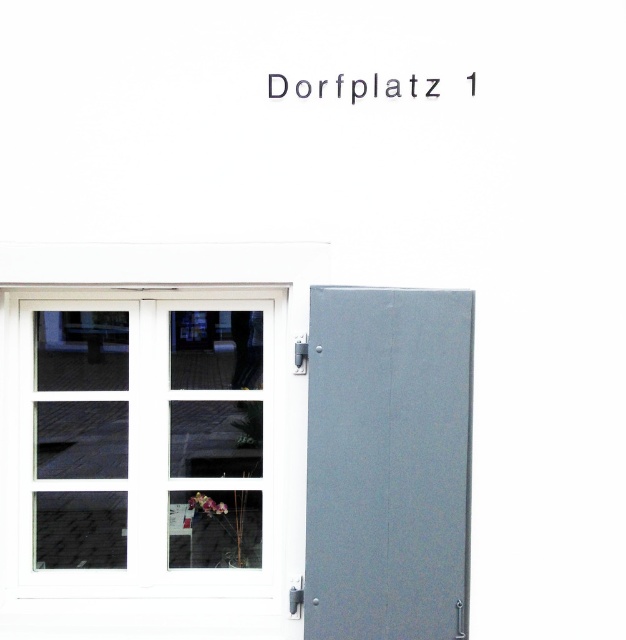
Question: Considering the relative positions of white glass window at center and gray matte door at right in the image provided, where is white glass window at center located with respect to gray matte door at right?

Choices:
 (A) right
 (B) left

Answer: (B)

Question: Which point is farther to the camera?

Choices:
 (A) (85, 538)
 (B) (369, 550)

Answer: (A)

Question: Is white glass window at center in front of gray matte door at right?

Choices:
 (A) no
 (B) yes

Answer: (A)

Question: Is white glass window at center to the left of gray matte door at right from the viewer's perspective?

Choices:
 (A) no
 (B) yes

Answer: (B)

Question: Which object is farther from the camera taking this photo?

Choices:
 (A) gray matte door at right
 (B) white glass window at center

Answer: (B)

Question: Which point is farther to the camera?

Choices:
 (A) gray matte door at right
 (B) white glass window at center

Answer: (B)